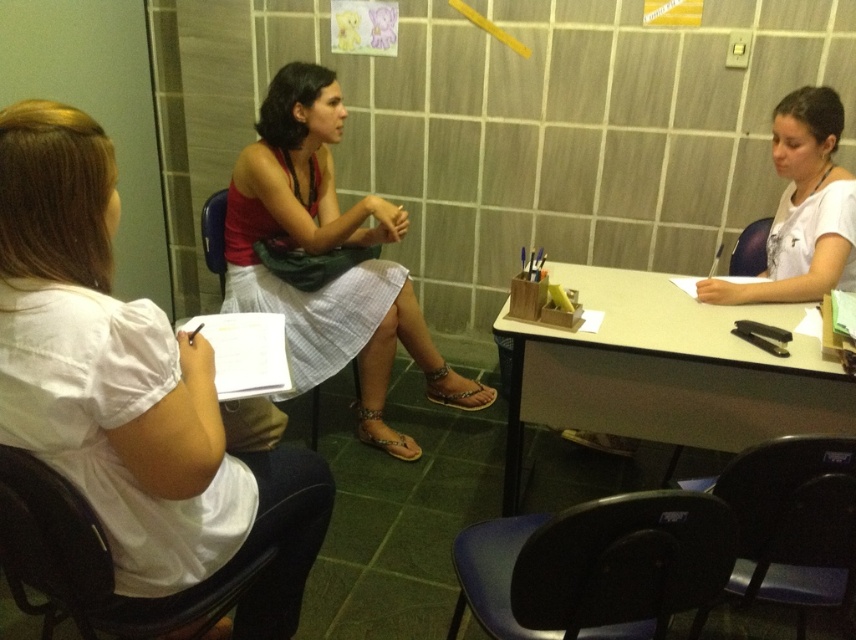
You are standing in the room and want to move to the point at coordinates (542,611). Considering the two seated individuals, is there enough space to walk directly to that point without disturbing them?

The point at coordinates (542,611) is 3.89 feet away from you. Since the two seated individuals are positioned in the foreground facing each other, there should be sufficient space to walk directly to the point without disturbing them, provided you navigate around their chairs carefully.

You are standing in the room and notice two points marked on the wall. The first point is at coordinate point (578,550) and the second at point (801,211). Which point is closer to you?

Point (578,550) is closer to the camera than point (801,211), so the first point is closer to you.

You are a person who wants to sit on the black plastic chair at lower center. However, you are wearing a long white matte shirt at right. Will your shirt get caught in the chair?

The black plastic chair at lower center is not as tall as the white matte shirt at right. Since the chair is shorter than the shirt, there is a risk that the white matte shirt at right could get caught in the chair when sitting down.